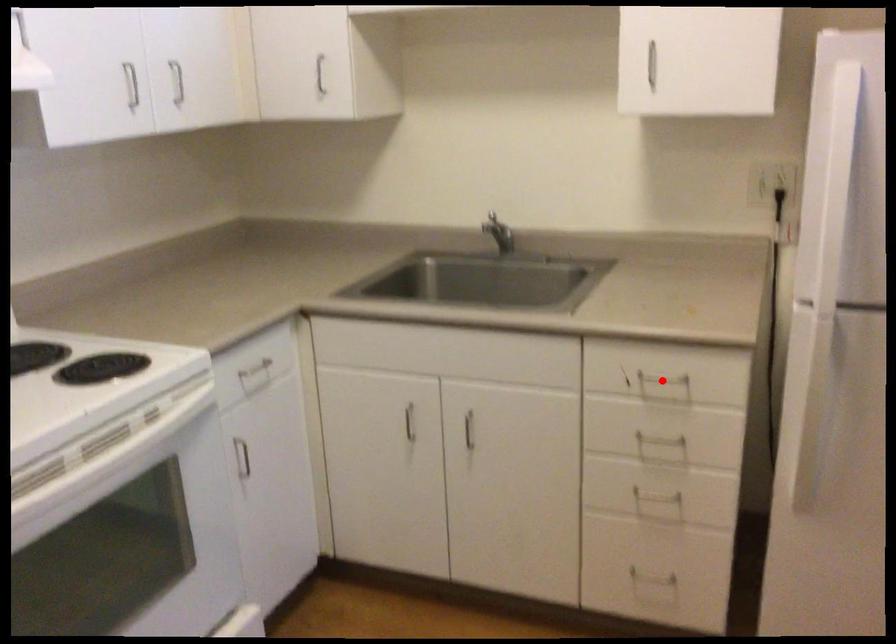
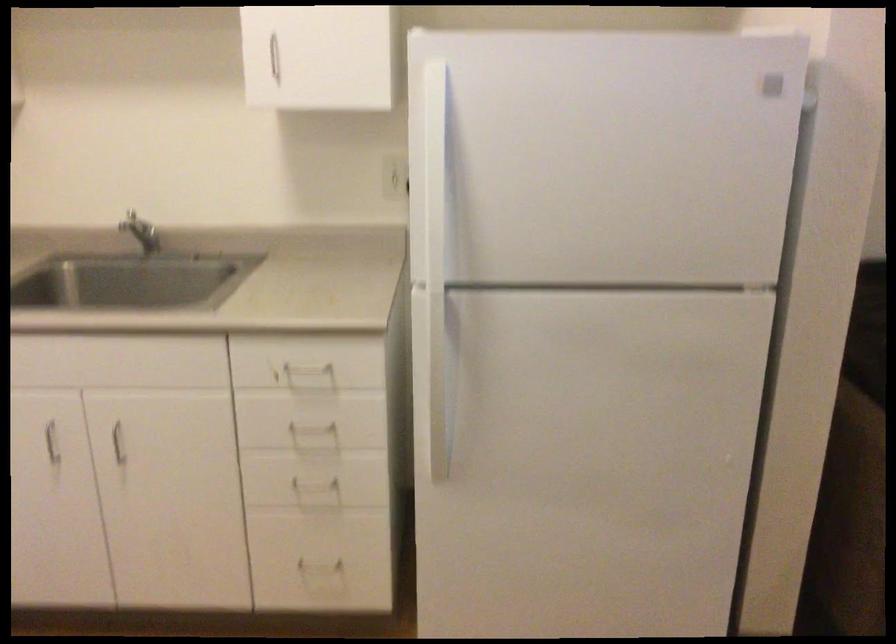
Where in the second image is the point corresponding to the highlighted location from the first image?

(307, 368)